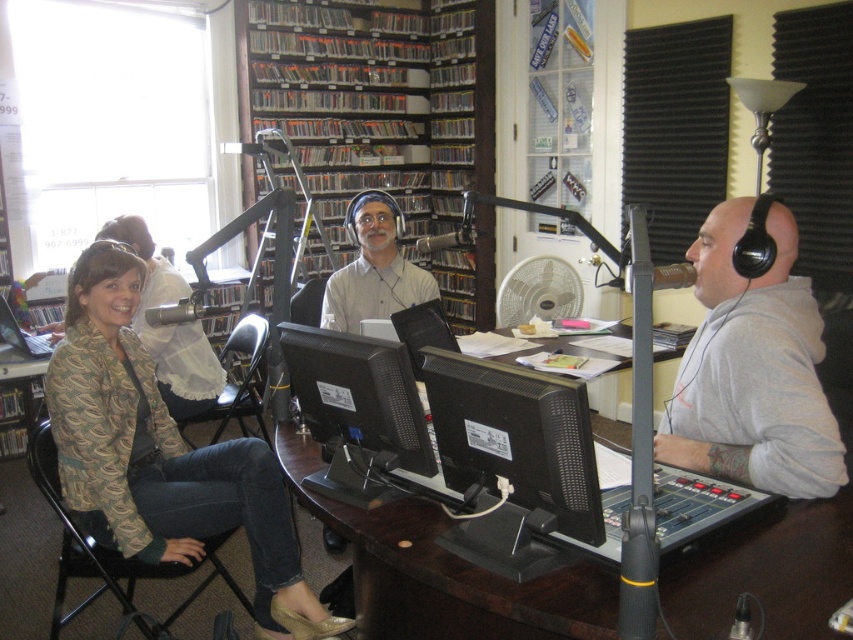
Question: Among these objects, which one is nearest to the camera?

Choices:
 (A) gray matte hoodie at right
 (B) black matte monitor at center
 (C) black glossy monitor at center
 (D) patterned fabric jacket at left

Answer: (B)

Question: Does black matte computer monitor at center have a greater width compared to matte gray shirt at center?

Choices:
 (A) no
 (B) yes

Answer: (A)

Question: Is black plastic computer desk at center to the right of black matte monitor at center from the viewer's perspective?

Choices:
 (A) no
 (B) yes

Answer: (B)

Question: Can you confirm if black plastic computer desk at center is positioned to the right of matte gray shirt at center?

Choices:
 (A) yes
 (B) no

Answer: (A)

Question: Which object is the farthest from the white plastic fan at center?

Choices:
 (A) black matte monitor at center
 (B) black glossy monitor at center
 (C) patterned fabric jacket at left
 (D) black matte computer monitor at center

Answer: (A)

Question: Which object appears farthest from the camera in this image?

Choices:
 (A) white plastic fan at center
 (B) black matte computer monitor at center

Answer: (A)